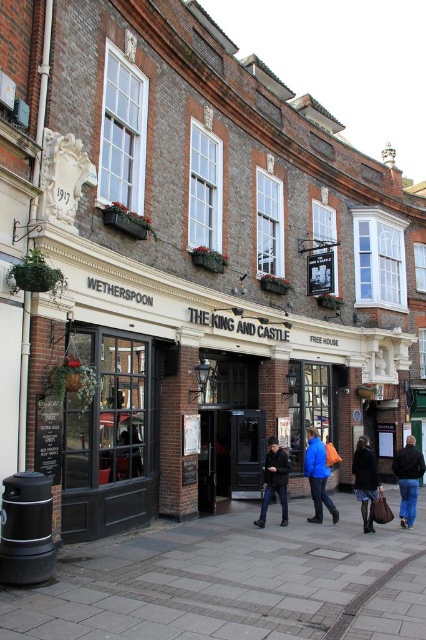
Based on the photo, you are trying to decide which item to take with you for a day out. Both the dark blue fabric coat at center and the dark blue leather jacket at center are available. If you want to choose the wider garment, which one should you pick?

The dark blue fabric coat at center is wider than the dark blue leather jacket at center, so you should pick the dark blue fabric coat at center.

You are a delivery person who needs to place a heavy box on the ground. You see the gray concrete pavement at lower center and the dark blue leather jacket at center. Which surface is suitable for placing the box?

The gray concrete pavement at lower center is suitable for placing the heavy box because it is positioned under the dark blue leather jacket at center, making it the stable and flat surface for the delivery.

You are a customer entering the pub and see a dark blue fabric coat at center and a dark blue leather jacket at center. Which item is placed higher up?

The dark blue fabric coat at center is above the dark blue leather jacket at center, so the coat is placed higher up.